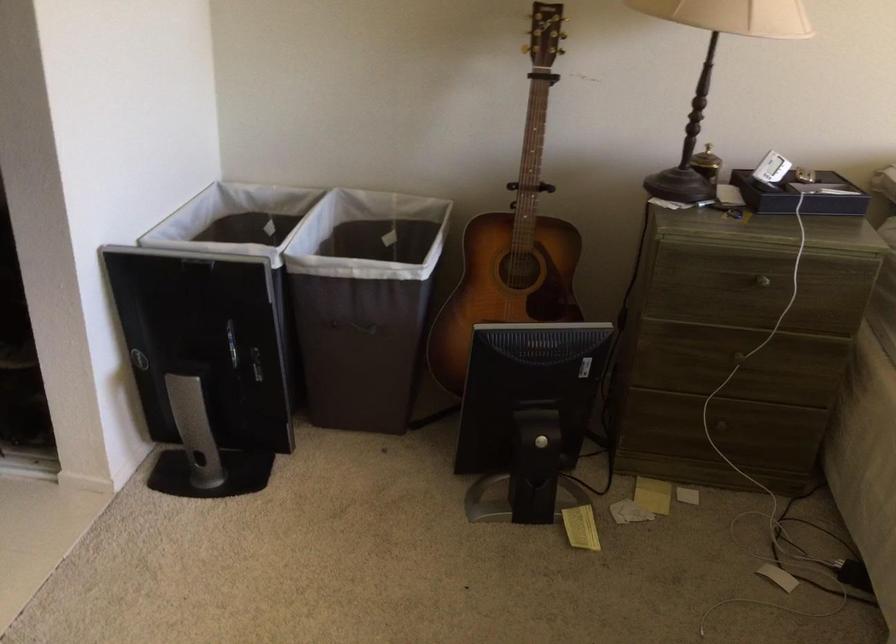
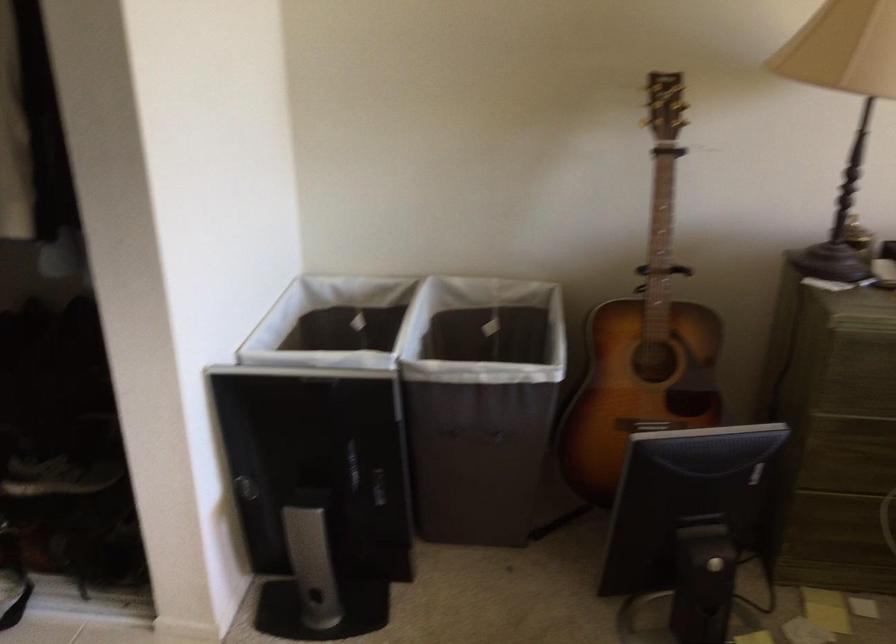
Question: The images are taken continuously from a first-person perspective. In which direction is your viewpoint rotating?

Choices:
 (A) Left
 (B) Right
 (C) Up
 (D) Down

Answer: (C)